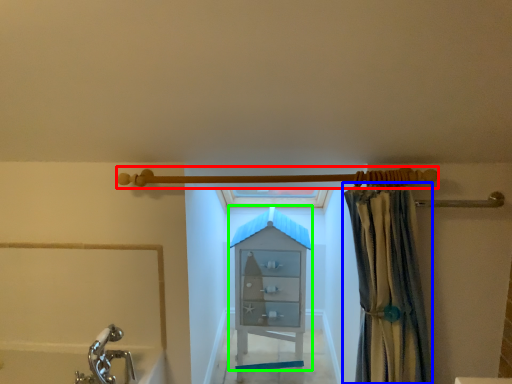
Question: Estimate the real-world distances between objects in this image. Which object is closer to shower (highlighted by a red box), curtain (highlighted by a blue box) or cabinet (highlighted by a green box)?

Choices:
 (A) curtain
 (B) cabinet

Answer: (A)